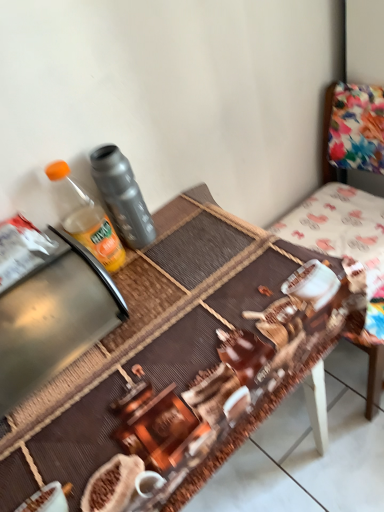
Image resolution: width=384 pixels, height=512 pixels. In order to click on free space in front of matte gray thermos at left, the 1th bottle viewed from the right in this screenshot , I will do `click(163, 280)`.